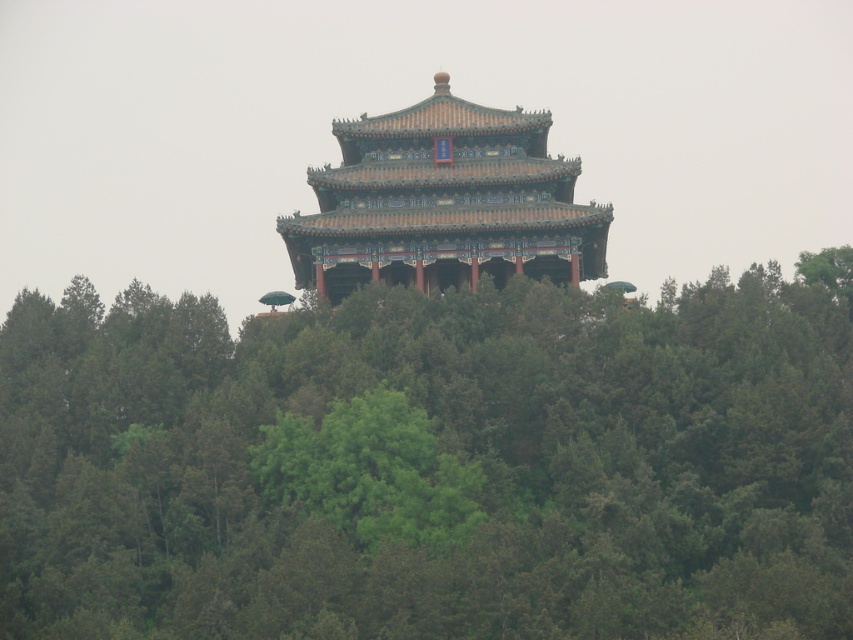
You are a bird flying over the hill and want to land on the highest point. Which object should you choose between the green leafy tree at center and the shiny orange pagoda at center?

The green leafy tree at center is taller than the shiny orange pagoda at center, so you should choose the green leafy tree at center to land on the highest point.

You are standing in a forest and want to reach the shiny orange pagoda at center. There is a green leafy tree at center blocking your view. Can you walk straight ahead towards the pagoda without going around the tree?

The green leafy tree at center is closer to the viewer than the shiny orange pagoda at center, so you can walk straight ahead towards the pagoda without going around the tree because the pagoda is behind the tree and you can navigate around it by moving past the tree.

You are an artist trying to paint the scene of the traditional Chinese pavilion. You want to ensure the green leafy tree at center and the shiny orange pagoda at center are placed correctly. Which object should be drawn first if you are following a left to right painting technique?

The green leafy tree at center should be drawn first since it is positioned on the left side of the shiny orange pagoda at center, following a left to right painting technique.